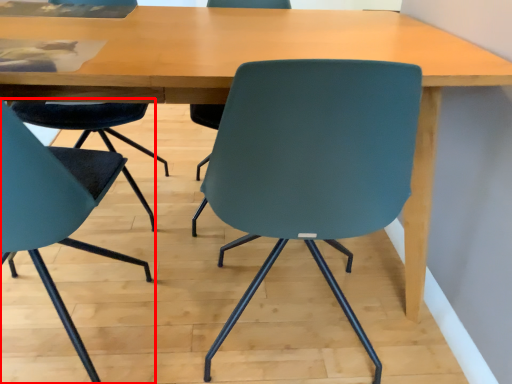
Question: From the image's perspective, what is the correct spatial positioning of chair (annotated by the red box) in reference to chair?

Choices:
 (A) above
 (B) below

Answer: (B)